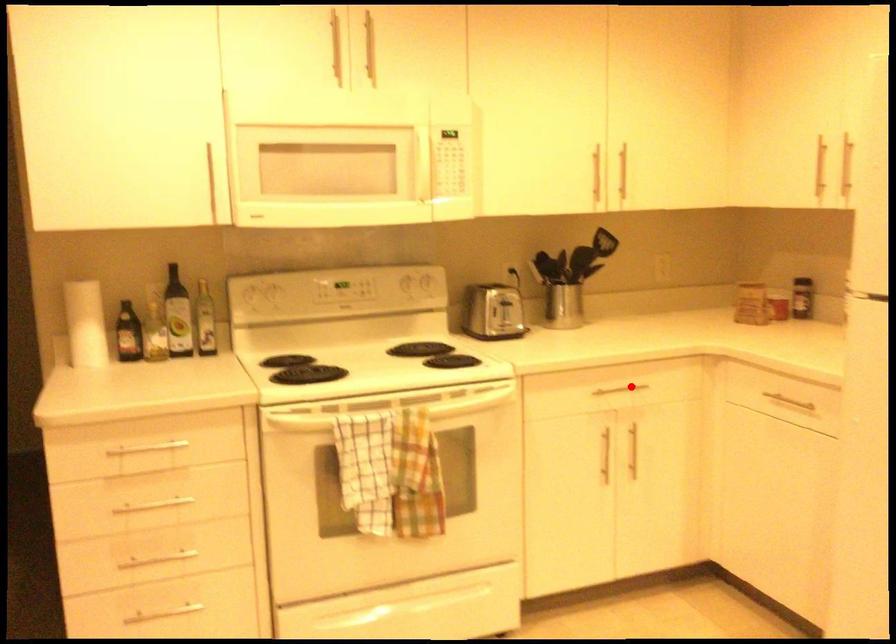
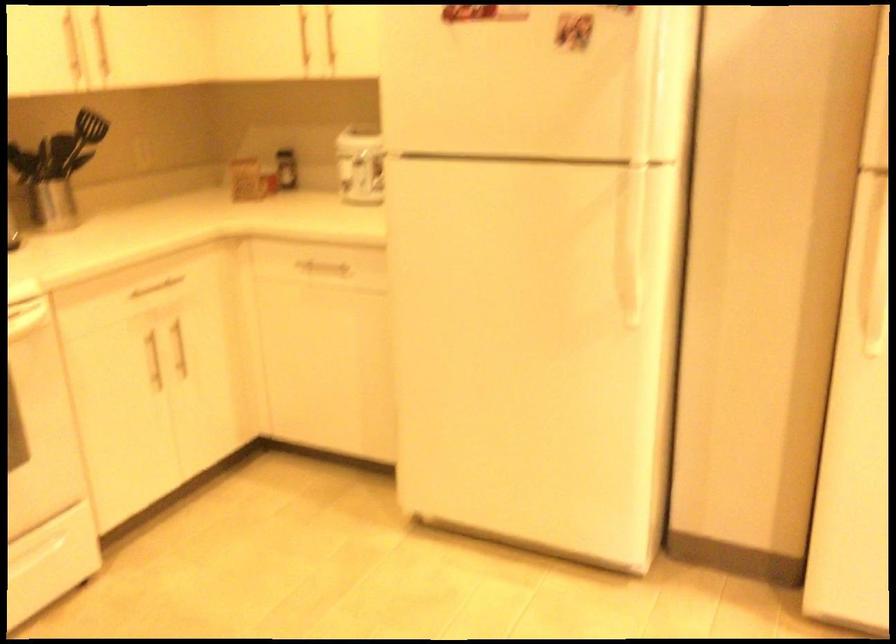
Locate, in the second image, the point that corresponds to the highlighted location in the first image.

(159, 283)